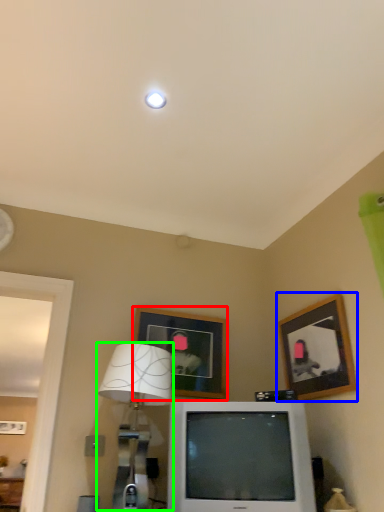
Question: Which is nearer to the picture frame (highlighted by a red box)? picture frame (highlighted by a blue box) or table lamp (highlighted by a green box).

Choices:
 (A) picture frame
 (B) table lamp

Answer: (B)